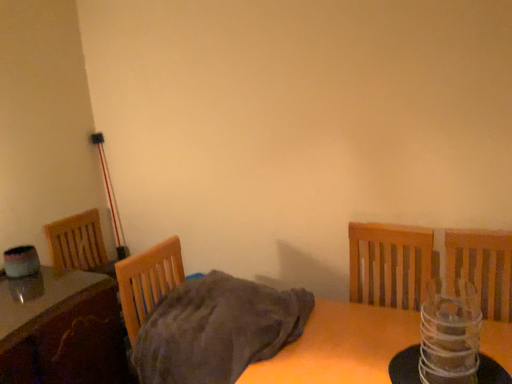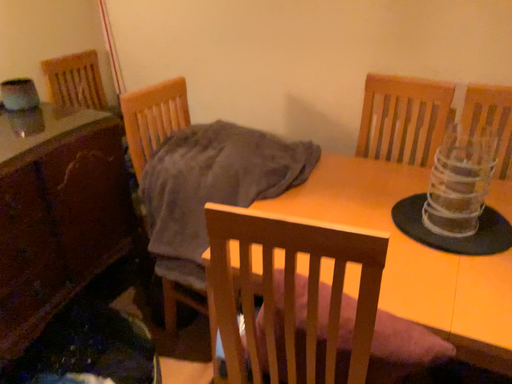
Question: How did the camera likely rotate when shooting the video?

Choices:
 (A) rotated upward
 (B) rotated downward

Answer: (B)